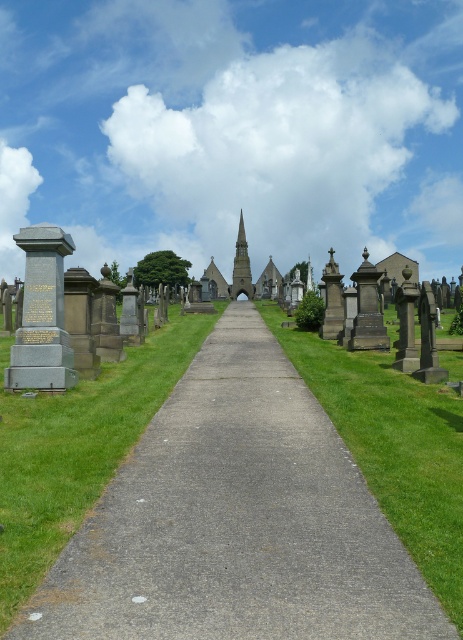
Is gray concrete pavement at center positioned behind smooth gray spire at center?

No, gray concrete pavement at center is closer to the viewer.

Between gray concrete pavement at center and smooth gray spire at center, which one has more height?

smooth gray spire at center

Locate an element on the screen. gray concrete pavement at center is located at coordinates (236, 522).